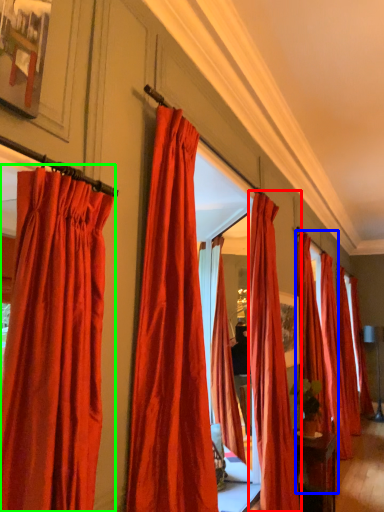
Question: Which object is positioned closest to curtain (highlighted by a red box)? Select from curtain (highlighted by a blue box) and curtain (highlighted by a green box).

Choices:
 (A) curtain
 (B) curtain

Answer: (A)